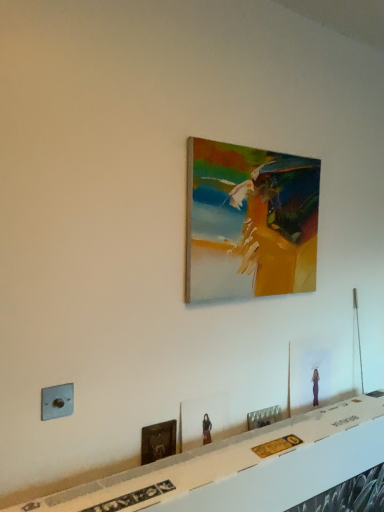
Question: From the image's perspective, is matte wooden picture frame at center, marked as the third picture frame in a top-to-bottom arrangement, positioned above or below metallic gray electric outlet at lower left?

Choices:
 (A) above
 (B) below

Answer: (B)

Question: Looking at their shapes, would you say matte wooden picture frame at center, the third picture frame in the bottom-to-top sequence, is wider or thinner than metallic gray electric outlet at lower left?

Choices:
 (A) thin
 (B) wide

Answer: (A)

Question: Which object is positioned closest to the white glossy table at lower center?

Choices:
 (A) wooden picture frame at lower left, which appears as the second picture frame when ordered from the bottom
 (B) matte glass picture frame at lower right, which is counted as the second picture frame, starting from the top
 (C) metallic gray electric outlet at lower left
 (D) wooden painting at center, the first picture frame viewed from the top
 (E) metallic silver picture frame at lower center, which is counted as the 5th picture frame, starting from the top

Answer: (E)

Question: Which object is the closest to the wooden picture frame at lower left, positioned as the fourth picture frame in top-to-bottom order?

Choices:
 (A) metallic gray electric outlet at lower left
 (B) matte glass picture frame at lower right, positioned as the 4th picture frame in bottom-to-top order
 (C) matte wooden picture frame at center, the third picture frame in the bottom-to-top sequence
 (D) wooden painting at center, arranged as the 5th picture frame when ordered from the bottom
 (E) metallic silver picture frame at lower center, which is counted as the 1th picture frame, starting from the bottom

Answer: (C)